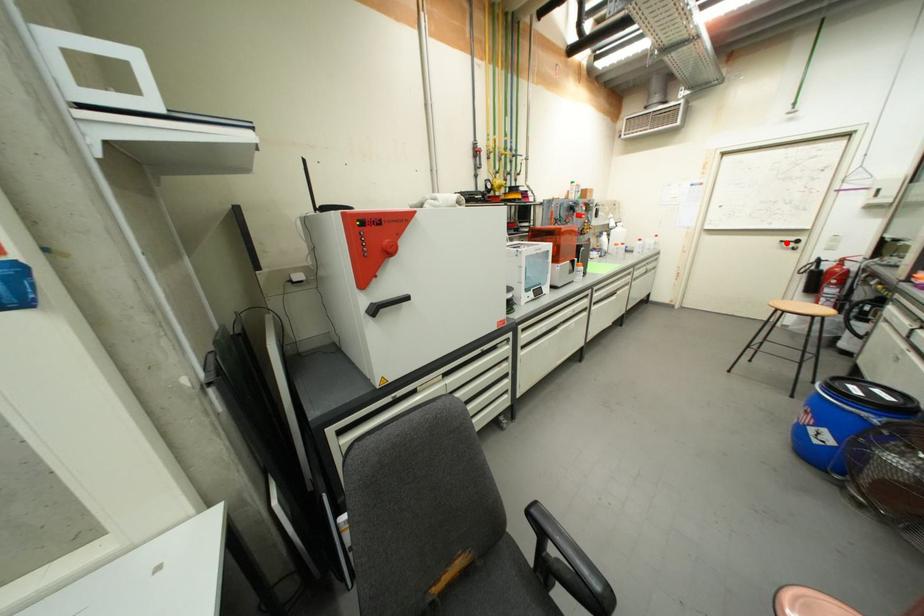
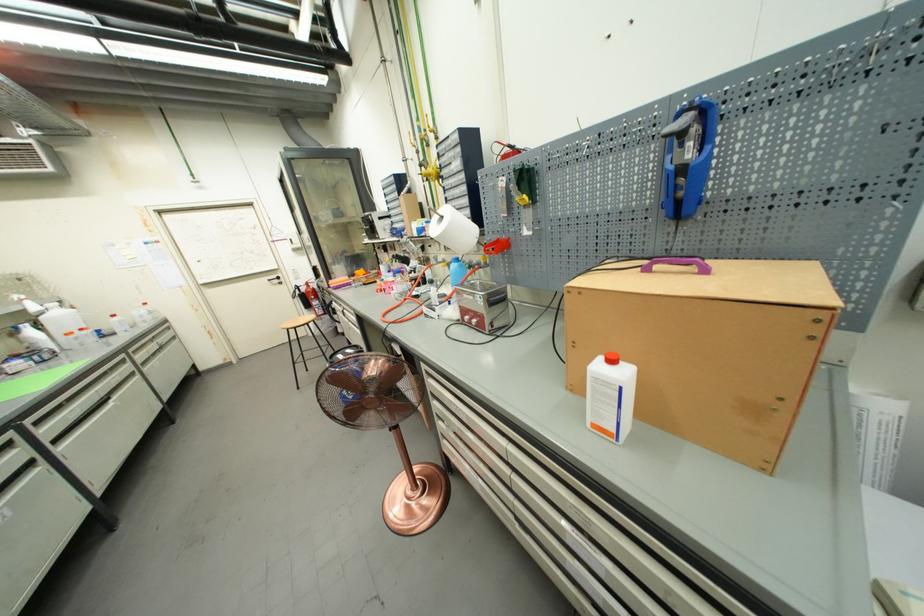
In the second image, find the point that corresponds to the highlighted location in the first image.

(274, 282)